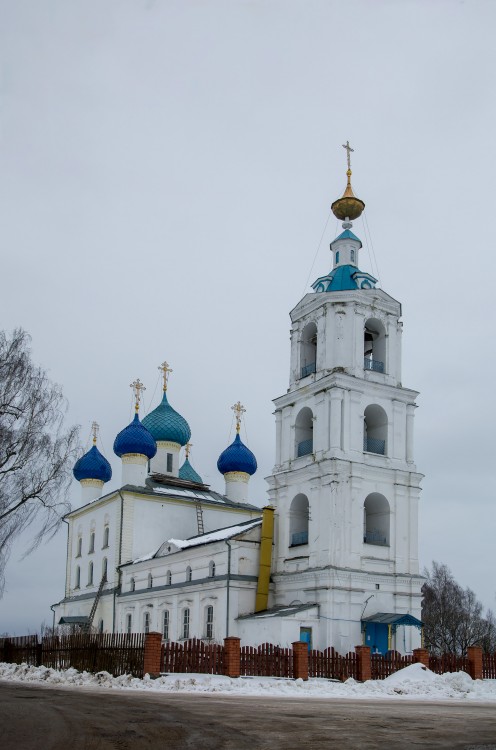
You are a GUI agent. You are given a task and a screenshot of the screen. Output one action in this format:
    pyautogui.click(x=<x>, y=<y>)
    Task: Click on the window
    This screenshot has width=496, height=750.
    Given the screenshot: What is the action you would take?
    pyautogui.click(x=208, y=631)